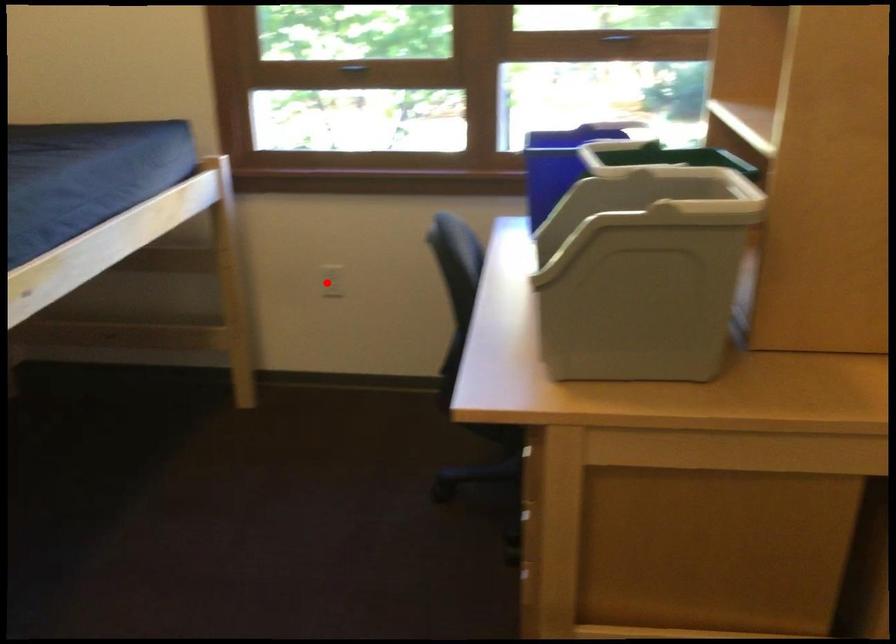
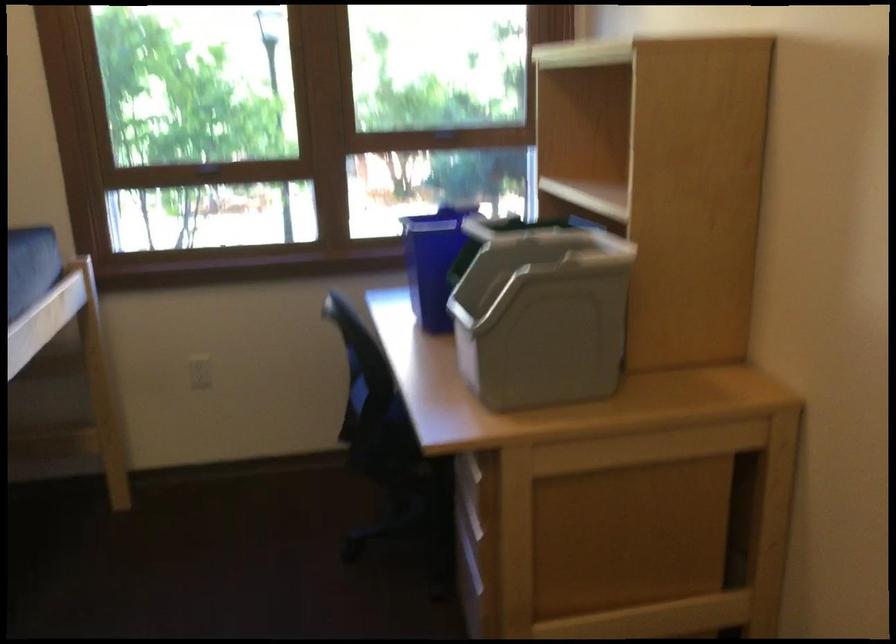
Question: I am providing you with two images of the same scene from different viewpoints. A red point is marked on the first image. Is the red point's position out of view in image 2?

Choices:
 (A) Yes
 (B) No

Answer: (B)